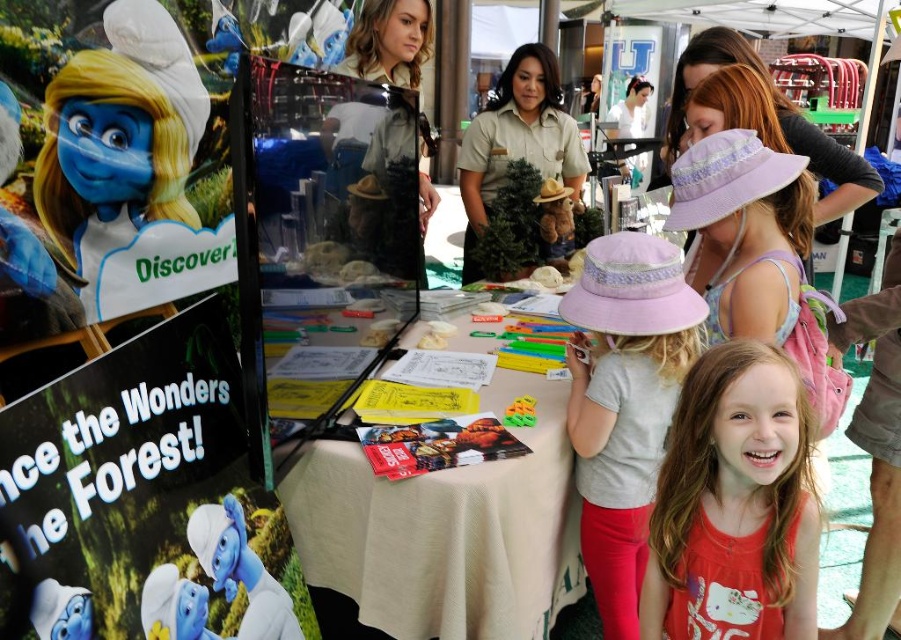
Between point (403, 637) and point (383, 60), which one is positioned in front?

Positioned in front is point (403, 637).

Is point (305, 540) more distant than point (378, 13)?

No, it is not.

Where is `white cloth table at center`? This screenshot has height=640, width=901. white cloth table at center is located at coordinates (446, 531).

Does khaki uniform at center appear under matte khaki uniform at center?

Yes.

Is point (547, 64) positioned after point (379, 42)?

Yes, point (547, 64) is behind point (379, 42).

Does point (478, 278) come closer to viewer compared to point (415, 24)?

No, (478, 278) is further to viewer.

Where is `khaki uniform at center`? khaki uniform at center is located at coordinates (517, 140).

Can you confirm if matte paper poster at lower left is smaller than pink fabric hat at upper center?

No, matte paper poster at lower left is not smaller than pink fabric hat at upper center.

Between point (92, 520) and point (616, 580), which one is positioned behind?

The point (616, 580) is more distant.

Locate an element on the screen. The height and width of the screenshot is (640, 901). matte paper poster at lower left is located at coordinates (144, 497).